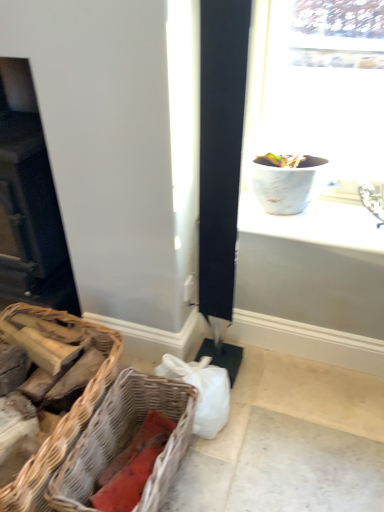
Question: Is brown wicker picnic basket at lower left, the 2th picnic basket when ordered from right to left, aimed at woven wood picnic basket at lower left, the first picnic basket viewed from the right?

Choices:
 (A) yes
 (B) no

Answer: (B)

Question: Is brown wicker picnic basket at lower left, the first picnic basket when ordered from left to right, at the left side of woven wood picnic basket at lower left, the first picnic basket viewed from the right?

Choices:
 (A) yes
 (B) no

Answer: (A)

Question: Is brown wicker picnic basket at lower left, the first picnic basket when ordered from left to right, positioned before woven wood picnic basket at lower left, the first picnic basket viewed from the right?

Choices:
 (A) no
 (B) yes

Answer: (B)

Question: Is brown wicker picnic basket at lower left, the first picnic basket when ordered from left to right, facing away from woven wood picnic basket at lower left, the 2th picnic basket in the left-to-right sequence?

Choices:
 (A) no
 (B) yes

Answer: (A)

Question: Are brown wicker picnic basket at lower left, the first picnic basket when ordered from left to right, and woven wood picnic basket at lower left, the first picnic basket viewed from the right, making contact?

Choices:
 (A) no
 (B) yes

Answer: (A)

Question: Does point (337, 204) appear closer or farther from the camera than point (56, 273)?

Choices:
 (A) closer
 (B) farther

Answer: (A)

Question: From the image's perspective, is white textured vase at upper right above or below matte black fireplace at left?

Choices:
 (A) above
 (B) below

Answer: (B)

Question: Relative to matte black fireplace at left, is white textured vase at upper right in front or behind?

Choices:
 (A) front
 (B) behind

Answer: (B)

Question: Would you say white textured vase at upper right is to the left or to the right of matte black fireplace at left in the picture?

Choices:
 (A) left
 (B) right

Answer: (B)

Question: Relative to matte black fireplace at left, is woven wood picnic basket at lower left, the first picnic basket viewed from the right, in front or behind?

Choices:
 (A) behind
 (B) front

Answer: (B)

Question: Is woven wood picnic basket at lower left, the first picnic basket viewed from the right, wider or thinner than matte black fireplace at left?

Choices:
 (A) wide
 (B) thin

Answer: (A)

Question: From the image's perspective, is woven wood picnic basket at lower left, the 2th picnic basket in the left-to-right sequence, located above or below matte black fireplace at left?

Choices:
 (A) below
 (B) above

Answer: (A)

Question: Considering the positions of woven wood picnic basket at lower left, the first picnic basket viewed from the right, and matte black fireplace at left in the image, is woven wood picnic basket at lower left, the first picnic basket viewed from the right, taller or shorter than matte black fireplace at left?

Choices:
 (A) short
 (B) tall

Answer: (A)

Question: Does point (268, 216) appear closer or farther from the camera than point (61, 482)?

Choices:
 (A) closer
 (B) farther

Answer: (B)

Question: Looking at the image, does white textured vase at upper right seem bigger or smaller compared to woven wood picnic basket at lower left, the first picnic basket viewed from the right?

Choices:
 (A) small
 (B) big

Answer: (A)